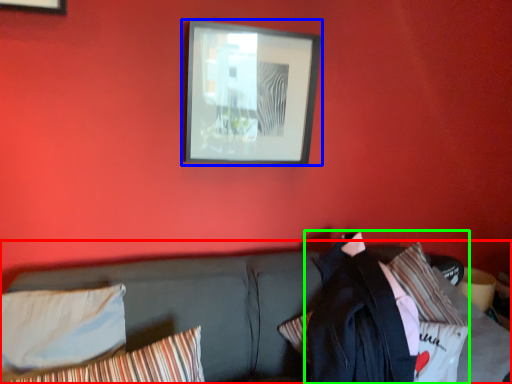
Question: Estimate the real-world distances between objects in this image. Which object is closer to studio couch (highlighted by a red box), picture frame (highlighted by a blue box) or jacket (highlighted by a green box)?

Choices:
 (A) picture frame
 (B) jacket

Answer: (B)